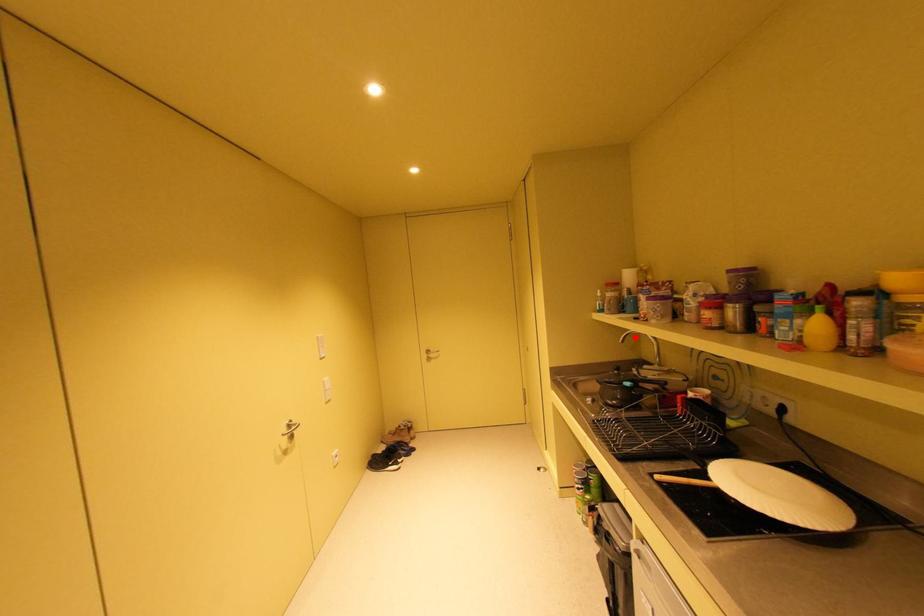
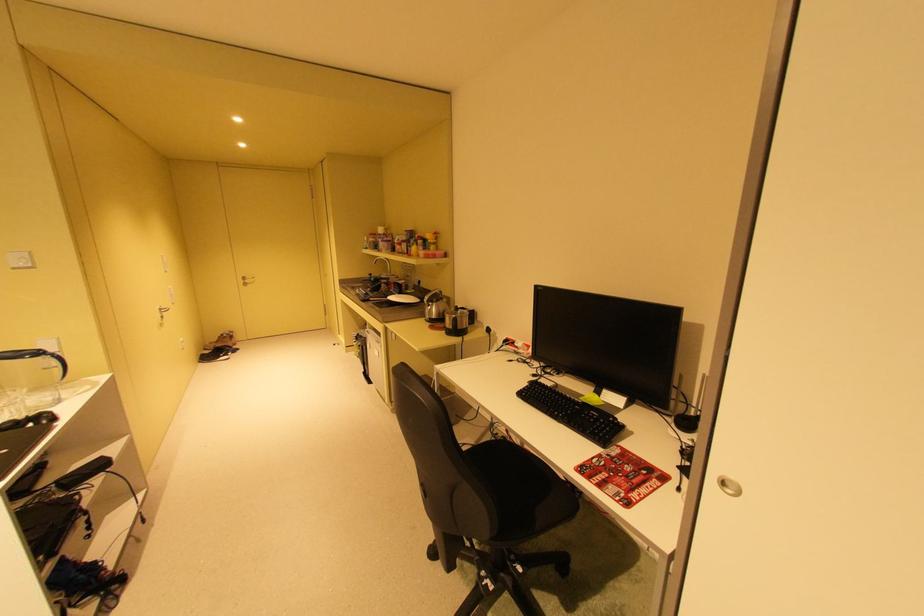
Question: I am providing you with two images of the same scene from different viewpoints. In image1, a red point is highlighted. Considering the same 3D point in image2, which of the following is correct?

Choices:
 (A) It is closer
 (B) It is farther

Answer: (A)